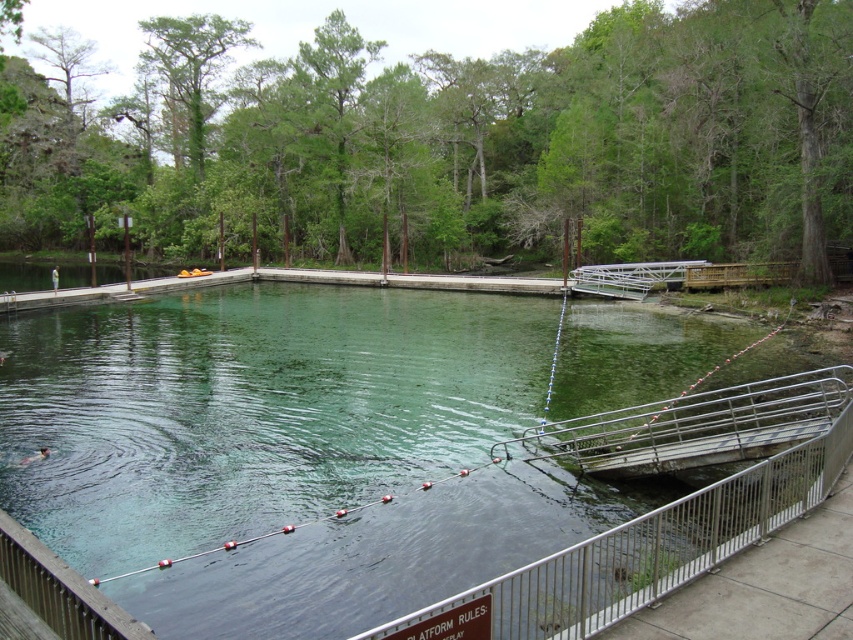
Who is taller, clear glass pond at center or metal/rustic rail at lower right?

Standing taller between the two is clear glass pond at center.

Does clear glass pond at center have a smaller size compared to metal/rustic rail at lower right?

Actually, clear glass pond at center might be larger than metal/rustic rail at lower right.

The image size is (853, 640). Find the location of `clear glass pond at center`. clear glass pond at center is located at coordinates (670, 509).